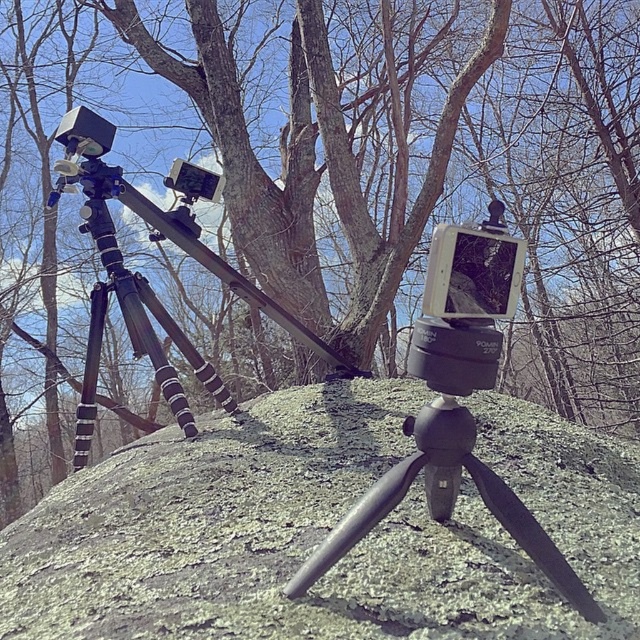
Question: Among these points, which one is farthest from the camera?

Choices:
 (A) (544, 561)
 (B) (609, 458)

Answer: (B)

Question: Considering the relative positions of green mossy rock at center and matte black tripod-mounted camera at center in the image provided, where is green mossy rock at center located with respect to matte black tripod-mounted camera at center?

Choices:
 (A) below
 (B) above

Answer: (A)

Question: Can you confirm if green mossy rock at center is positioned to the left of matte black tripod-mounted camera at center?

Choices:
 (A) yes
 (B) no

Answer: (A)

Question: Which point appears farthest from the camera in this image?

Choices:
 (A) (408, 353)
 (B) (268, 616)

Answer: (A)

Question: Does green mossy rock at center have a smaller size compared to matte black tripod-mounted camera at center?

Choices:
 (A) yes
 (B) no

Answer: (B)